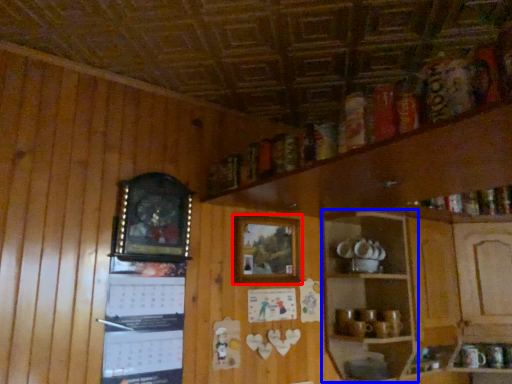
Question: Which object appears closest to the camera in this image, picture frame (highlighted by a red box) or shelf (highlighted by a blue box)?

Choices:
 (A) picture frame
 (B) shelf

Answer: (B)